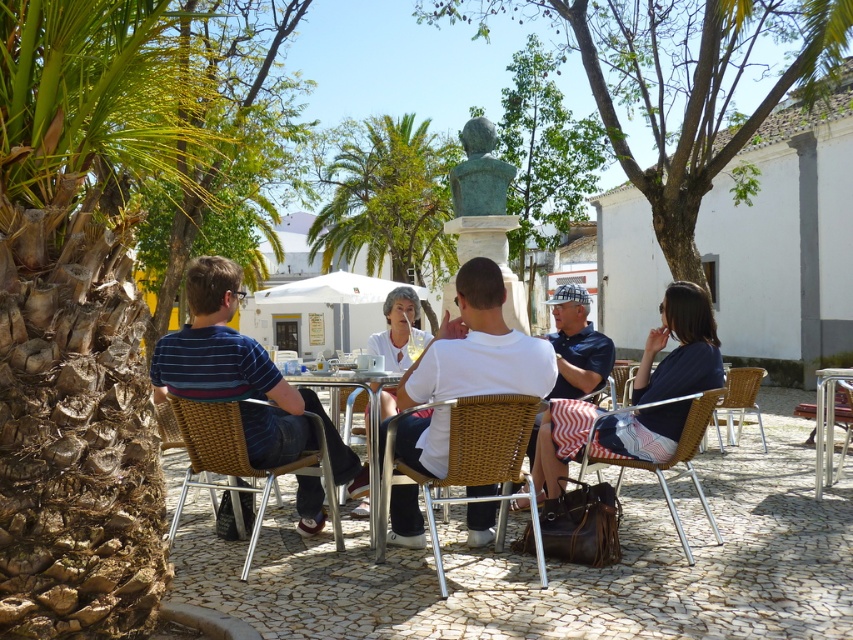
You are a customer at the outdoor cafe and want to sit down. You see a rattan chair at lower center and a white cotton shirt at center. Which object is wider?

The rattan chair at lower center is wider than the white cotton shirt at center according to the description.

From the picture: You are a customer at the outdoor cafe and want to place your coffee cup on the metallic silver table at center. However, there is a point at coordinate (364,410) on the table. Can you confirm if this point is on the metallic silver table at center?

Yes, the point at coordinate (364,410) is on the metallic silver table at center as stated in the Objects Description.

You are a customer at the outdoor cafe and want to sit at the metallic silver table at center. The chair you need to use is the woven rattan chair at lower right. Can you comfortably sit at the table with the chair?

The metallic silver table at center has a lesser width compared to the woven rattan chair at lower right. This means the table is narrower than the chair, so the chair might not fit comfortably under the table. It is advisable to choose a chair with a smaller size or a table with a larger width for better comfort.